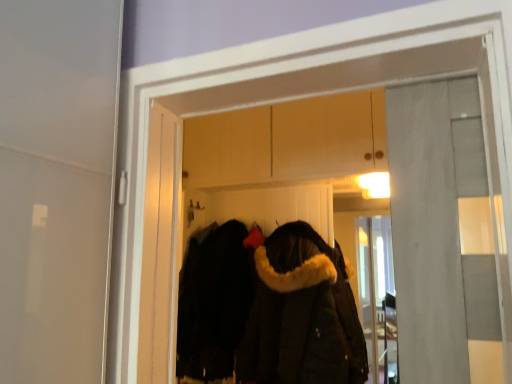
The height and width of the screenshot is (384, 512). What do you see at coordinates (286, 161) in the screenshot? I see `black fur-lined coat at center` at bounding box center [286, 161].

Image resolution: width=512 pixels, height=384 pixels. I want to click on black fuzzy coat at center, the 2th cloak in the right-to-left sequence, so click(213, 302).

This screenshot has height=384, width=512. I want to click on dark brown fur-lined coat at center, the 1th cloak in the right-to-left sequence, so click(x=301, y=314).

Is black fur-lined coat at center next to black fuzzy coat at center, the first cloak from the left?

black fur-lined coat at center and black fuzzy coat at center, the first cloak from the left, are clearly separated.

The image size is (512, 384). Identify the location of cloak that is on the left side of black fur-lined coat at center. click(x=213, y=302).

From a real-world perspective, which object stands above the other?

black fur-lined coat at center, from a real-world perspective.

In the scene shown: Are black fuzzy coat at center, the first cloak from the left, and black fur-lined coat at center far apart?

Actually, black fuzzy coat at center, the first cloak from the left, and black fur-lined coat at center are a little close together.

From a real-world perspective, is black fuzzy coat at center, the 2th cloak in the right-to-left sequence, on black fur-lined coat at center?

No, from a real-world perspective, black fuzzy coat at center, the 2th cloak in the right-to-left sequence, is not on top of black fur-lined coat at center.

Would you say black fuzzy coat at center, the 2th cloak in the right-to-left sequence, contains black fur-lined coat at center?

Definitely not — black fur-lined coat at center is not inside black fuzzy coat at center, the 2th cloak in the right-to-left sequence.

Does black fuzzy coat at center, the 2th cloak in the right-to-left sequence, have a smaller size compared to black fur-lined coat at center?

Correct, black fuzzy coat at center, the 2th cloak in the right-to-left sequence, occupies less space than black fur-lined coat at center.

Could you tell me if dark brown fur-lined coat at center, the 1th cloak in the right-to-left sequence, is facing black fuzzy coat at center, the 2th cloak in the right-to-left sequence?

No, dark brown fur-lined coat at center, the 1th cloak in the right-to-left sequence, is not facing towards black fuzzy coat at center, the 2th cloak in the right-to-left sequence.

Is dark brown fur-lined coat at center, the 2th cloak from the left, in front of or behind black fuzzy coat at center, the first cloak from the left, in the image?

dark brown fur-lined coat at center, the 2th cloak from the left, is positioned closer to the viewer than black fuzzy coat at center, the first cloak from the left.

Where is `cloak above the dark brown fur-lined coat at center, the 1th cloak in the right-to-left sequence (from the image's perspective)`? cloak above the dark brown fur-lined coat at center, the 1th cloak in the right-to-left sequence (from the image's perspective) is located at coordinates (213, 302).

From the image's perspective, which object appears higher, dark brown fur-lined coat at center, the 2th cloak from the left, or black fuzzy coat at center, the 2th cloak in the right-to-left sequence?

black fuzzy coat at center, the 2th cloak in the right-to-left sequence.

Is black fuzzy coat at center, the 2th cloak in the right-to-left sequence, next to dark brown fur-lined coat at center, the 1th cloak in the right-to-left sequence?

black fuzzy coat at center, the 2th cloak in the right-to-left sequence, is not next to dark brown fur-lined coat at center, the 1th cloak in the right-to-left sequence, and they're not touching.

Is black fuzzy coat at center, the first cloak from the left, aimed at dark brown fur-lined coat at center, the 2th cloak from the left?

No, black fuzzy coat at center, the first cloak from the left, is not aimed at dark brown fur-lined coat at center, the 2th cloak from the left.

Considering the sizes of objects black fuzzy coat at center, the first cloak from the left, and dark brown fur-lined coat at center, the 2th cloak from the left, in the image provided, who is wider, black fuzzy coat at center, the first cloak from the left, or dark brown fur-lined coat at center, the 2th cloak from the left,?

black fuzzy coat at center, the first cloak from the left.

Who is bigger, black fuzzy coat at center, the first cloak from the left, or dark brown fur-lined coat at center, the 1th cloak in the right-to-left sequence?

Bigger between the two is dark brown fur-lined coat at center, the 1th cloak in the right-to-left sequence.

Is black fur-lined coat at center facing away from dark brown fur-lined coat at center, the 2th cloak from the left?

Yes, dark brown fur-lined coat at center, the 2th cloak from the left, is at the back of black fur-lined coat at center.

From the image's perspective, is black fur-lined coat at center on top of dark brown fur-lined coat at center, the 1th cloak in the right-to-left sequence?

Yes, from the image's perspective, black fur-lined coat at center is on top of dark brown fur-lined coat at center, the 1th cloak in the right-to-left sequence.

This screenshot has width=512, height=384. Find the location of `clothing store above the dark brown fur-lined coat at center, the 1th cloak in the right-to-left sequence (from a real-world perspective)`. clothing store above the dark brown fur-lined coat at center, the 1th cloak in the right-to-left sequence (from a real-world perspective) is located at coordinates (286, 161).

Based on their positions, is black fur-lined coat at center located to the left or right of dark brown fur-lined coat at center, the 1th cloak in the right-to-left sequence?

Based on their positions, black fur-lined coat at center is located to the left of dark brown fur-lined coat at center, the 1th cloak in the right-to-left sequence.

Which of these two, dark brown fur-lined coat at center, the 1th cloak in the right-to-left sequence, or black fur-lined coat at center, is thinner?

black fur-lined coat at center.

Based on their sizes in the image, would you say dark brown fur-lined coat at center, the 1th cloak in the right-to-left sequence, is bigger or smaller than black fur-lined coat at center?

In the image, dark brown fur-lined coat at center, the 1th cloak in the right-to-left sequence, appears to be smaller than black fur-lined coat at center.

Is dark brown fur-lined coat at center, the 2th cloak from the left, far away from black fur-lined coat at center?

No, dark brown fur-lined coat at center, the 2th cloak from the left, is not far from black fur-lined coat at center.

From the image's perspective, starting from the black fur-lined coat at center, which cloak is the 1st one below? Please provide its 2D coordinates.

[(213, 302)]

The height and width of the screenshot is (384, 512). I want to click on clothing store above the black fuzzy coat at center, the first cloak from the left (from a real-world perspective), so click(x=286, y=161).

Looking at the image, which one is located further to black fuzzy coat at center, the 2th cloak in the right-to-left sequence, dark brown fur-lined coat at center, the 1th cloak in the right-to-left sequence, or black fur-lined coat at center?

black fur-lined coat at center.

Which object lies further to the anchor point black fur-lined coat at center, black fuzzy coat at center, the 2th cloak in the right-to-left sequence, or dark brown fur-lined coat at center, the 2th cloak from the left?

Among the two, dark brown fur-lined coat at center, the 2th cloak from the left, is located further to black fur-lined coat at center.

Considering their positions, is black fur-lined coat at center positioned closer to black fuzzy coat at center, the 2th cloak in the right-to-left sequence, than dark brown fur-lined coat at center, the 2th cloak from the left?

Among the two, dark brown fur-lined coat at center, the 2th cloak from the left, is located nearer to black fuzzy coat at center, the 2th cloak in the right-to-left sequence.

From the image, which object appears to be farther from black fur-lined coat at center, dark brown fur-lined coat at center, the 2th cloak from the left, or black fuzzy coat at center, the first cloak from the left?

dark brown fur-lined coat at center, the 2th cloak from the left.

Looking at the image, which one is located closer to dark brown fur-lined coat at center, the 1th cloak in the right-to-left sequence, black fur-lined coat at center or black fuzzy coat at center, the 2th cloak in the right-to-left sequence?

The object closer to dark brown fur-lined coat at center, the 1th cloak in the right-to-left sequence, is black fuzzy coat at center, the 2th cloak in the right-to-left sequence.

Estimate the real-world distances between objects in this image. Which object is further from dark brown fur-lined coat at center, the 2th cloak from the left, black fuzzy coat at center, the 2th cloak in the right-to-left sequence, or black fur-lined coat at center?

black fur-lined coat at center.

Where is `clothing store situated between black fuzzy coat at center, the first cloak from the left, and dark brown fur-lined coat at center, the 2th cloak from the left, from left to right`? This screenshot has width=512, height=384. clothing store situated between black fuzzy coat at center, the first cloak from the left, and dark brown fur-lined coat at center, the 2th cloak from the left, from left to right is located at coordinates (286, 161).